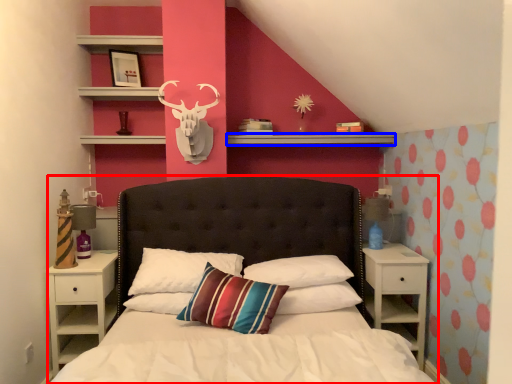
Question: Which point is further to the camera, bed (highlighted by a red box) or mantle (highlighted by a blue box)?

Choices:
 (A) bed
 (B) mantle

Answer: (B)